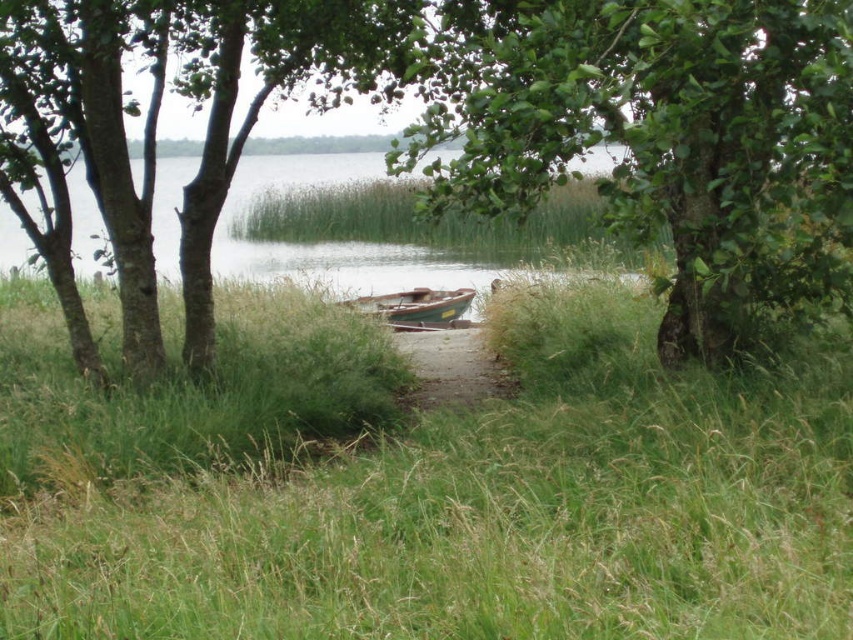
Question: Is green grassy at center to the right of wooden boat at center from the viewer's perspective?

Choices:
 (A) no
 (B) yes

Answer: (A)

Question: Which object is closer to the camera taking this photo?

Choices:
 (A) green leafy tree at center
 (B) rough bark tree at center
 (C) wooden boat at center

Answer: (A)

Question: Is green grassy at center wider than brown dirt path at center?

Choices:
 (A) no
 (B) yes

Answer: (B)

Question: Based on their relative distances, which object is nearer to the green leafy tree at center?

Choices:
 (A) green grassy at center
 (B) brown dirt path at center
 (C) rough bark tree at center

Answer: (A)

Question: Which is farther from the green grassy at center?

Choices:
 (A) rough bark tree at center
 (B) brown dirt path at center

Answer: (B)

Question: Is green grassy at center wider than green leafy tree at center?

Choices:
 (A) yes
 (B) no

Answer: (A)